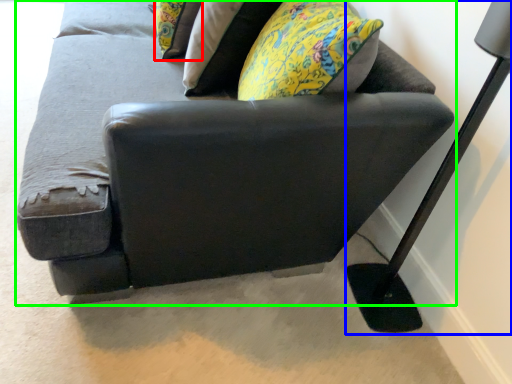
Question: Which object is positioned farthest from pillow (highlighted by a red box)? Select from table lamp (highlighted by a blue box) and studio couch (highlighted by a green box).

Choices:
 (A) table lamp
 (B) studio couch

Answer: (A)